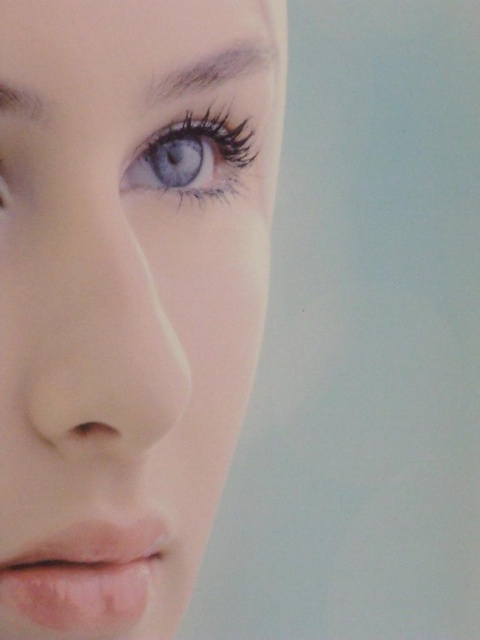
Question: Considering the relative positions of smooth skin nose at center and gray matte eyebrow at upper left in the image provided, where is smooth skin nose at center located with respect to gray matte eyebrow at upper left?

Choices:
 (A) above
 (B) below

Answer: (B)

Question: Does smooth skin face at upper left have a greater width compared to smooth skin nose at center?

Choices:
 (A) yes
 (B) no

Answer: (A)

Question: Which of the following is the farthest from the observer?

Choices:
 (A) (195, 90)
 (B) (122, 632)
 (C) (63, 332)
 (D) (171, 170)

Answer: (D)

Question: Which of these objects is positioned closest to the smooth skin nose at center?

Choices:
 (A) gray matte eyebrow at upper left
 (B) matte blue eye at upper left
 (C) smooth skin face at upper left
 (D) pale matte lips at lower left

Answer: (C)

Question: Does pale matte lips at lower left come in front of matte blue eye at upper left?

Choices:
 (A) no
 (B) yes

Answer: (B)

Question: Which of these objects is positioned closest to the pale matte lips at lower left?

Choices:
 (A) smooth skin nose at center
 (B) matte blue eye at upper left
 (C) smooth skin face at upper left

Answer: (A)